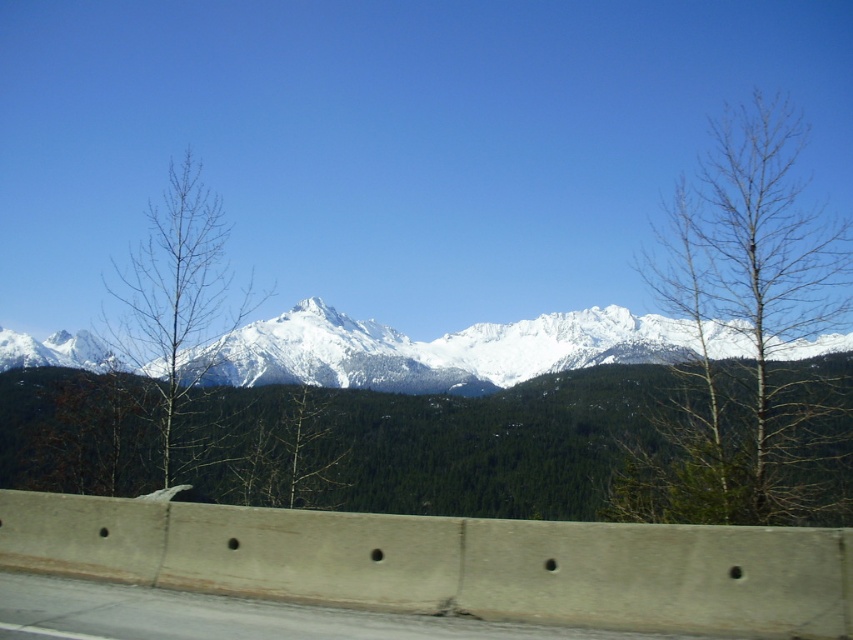
Is bare wood tree at right taller than white snow-covered mountain range at center?

Correct, bare wood tree at right is much taller as white snow-covered mountain range at center.

Which is behind, point (705, 426) or point (601, 358)?

The point (601, 358) is more distant.

Locate an element on the screen. bare wood tree at right is located at coordinates (746, 339).

Describe the element at coordinates (440, 349) in the screenshot. I see `white snow-covered mountain range at center` at that location.

Who is more forward, (50, 337) or (166, 426)?

Point (166, 426) is more forward.

Does point (596, 308) lie behind point (175, 316)?

Yes.

The width and height of the screenshot is (853, 640). I want to click on white snow-covered mountain range at center, so click(440, 349).

Between point (828, 232) and point (200, 316), which one is positioned in front?

Point (828, 232) is in front.

Who is positioned more to the right, bare wood tree at right or bare wood tree at left?

bare wood tree at right is more to the right.

Where is `bare wood tree at right`? Image resolution: width=853 pixels, height=640 pixels. bare wood tree at right is located at coordinates (746, 339).